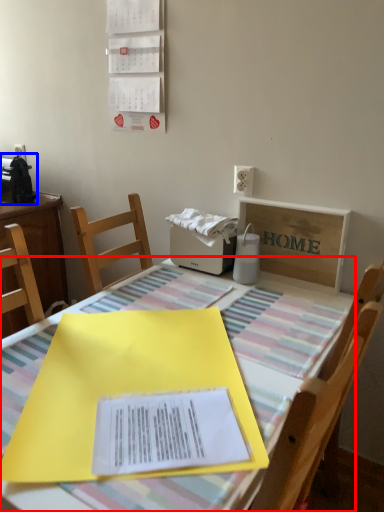
Question: Which object is closer to the camera taking this photo, table (highlighted by a red box) or appliance (highlighted by a blue box)?

Choices:
 (A) table
 (B) appliance

Answer: (A)